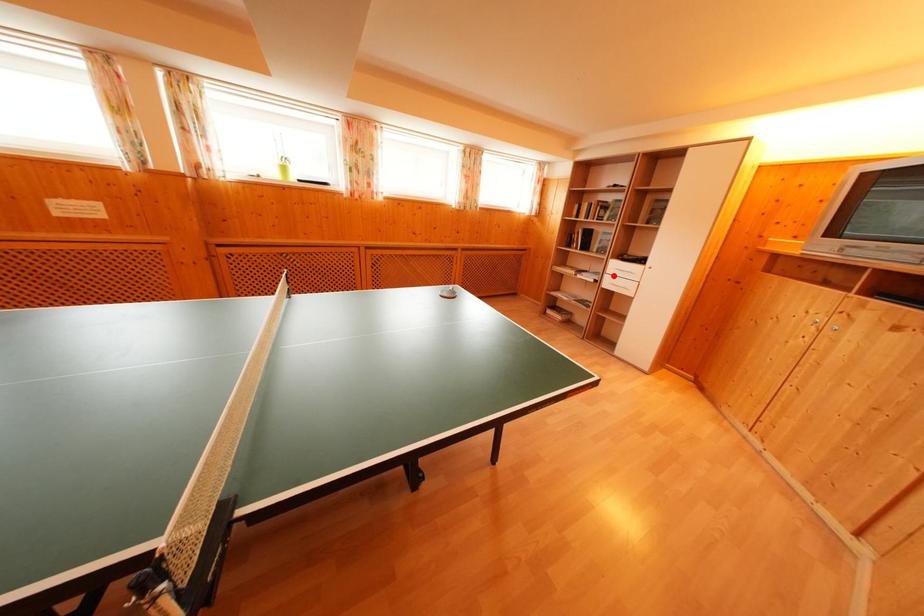
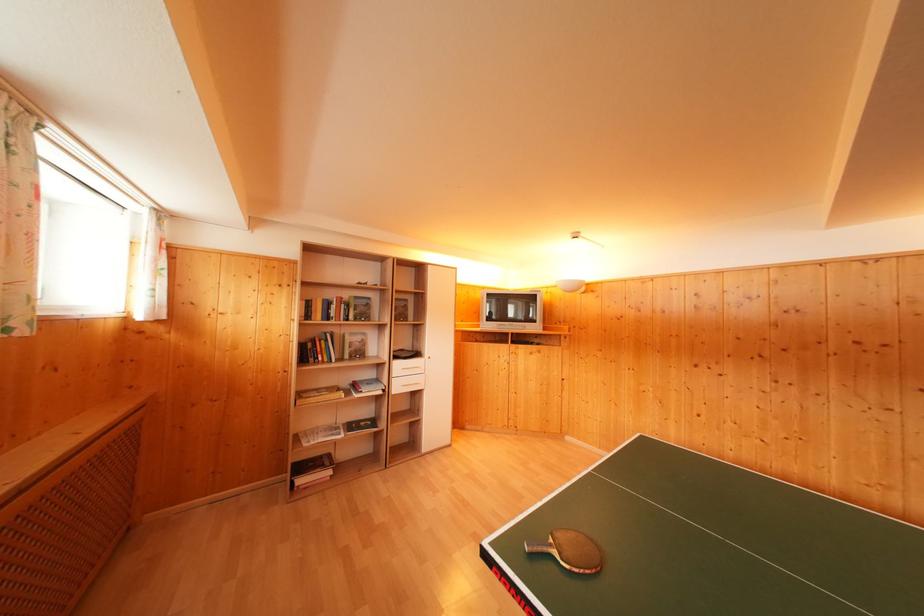
Find the pixel in the second image that matches the highlighted location in the first image.

(398, 379)